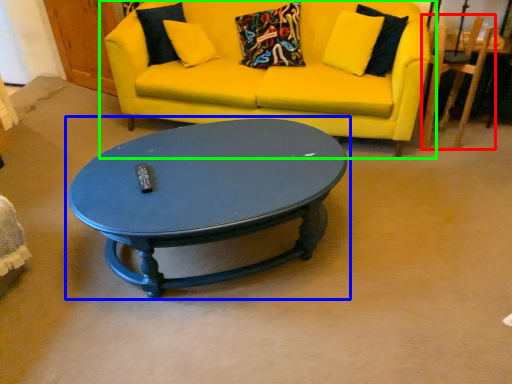
Question: Which object is positioned farthest from armchair (highlighted by a red box)? Select from coffee table (highlighted by a blue box) and studio couch (highlighted by a green box).

Choices:
 (A) coffee table
 (B) studio couch

Answer: (A)